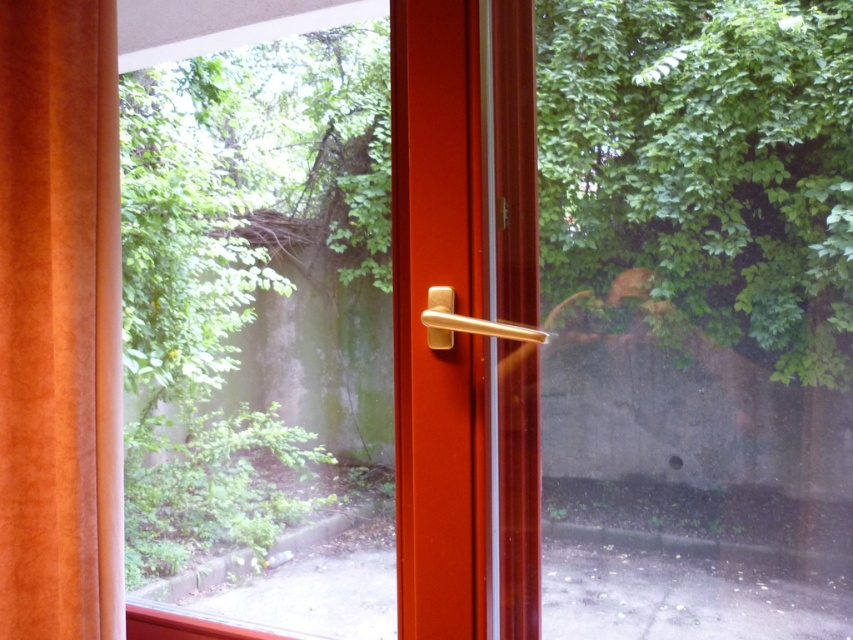
You are a delivery robot with a width of 1 meter. You need to pass through the gap between the point at (524, 230) and the door frame. Can you fit through?

The gap between the point at (524, 230) and the door frame is 1.13 meters, so yes, the robot can fit through since it is wider than the robot.

You are standing in the room and see the point marked at coordinate point (94, 515). Can you reach that point with your hand if you extend it fully?

The point at coordinate point (94, 515) is 1.19 meters away from the viewer. Since the average human arm length is about 0.7 meters, you cannot reach it with your hand extended fully.

You are standing inside a room and want to exit through the glass door with a red frame. You see the suede orange curtain at left and the gold metallic door handle at center. Which object should you interact with first to open the door?

You should interact with the gold metallic door handle at center first to open the door, as it is positioned at the center and closer to the door mechanism compared to the suede orange curtain at left which is on the side.